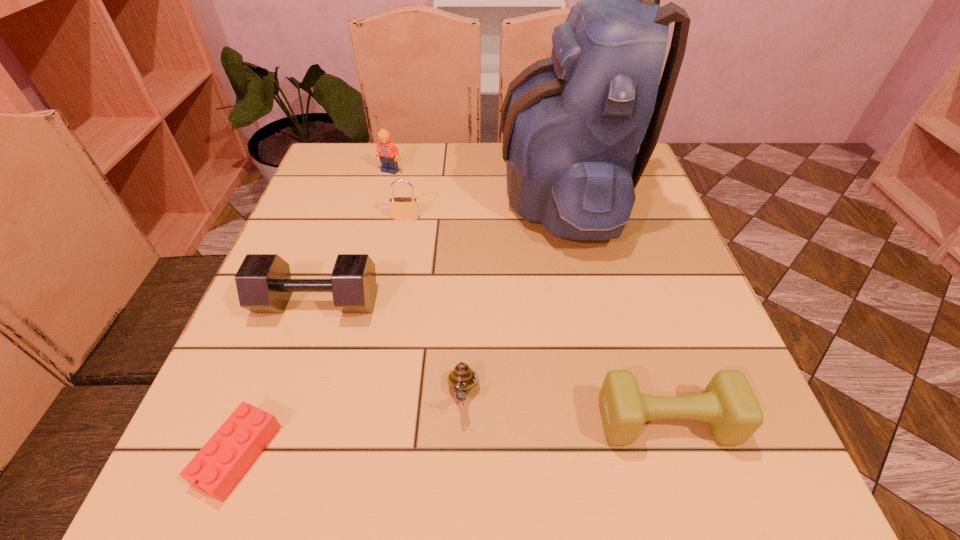
Where is `object present at the near right corner`? This screenshot has width=960, height=540. object present at the near right corner is located at coordinates (728, 404).

The width and height of the screenshot is (960, 540). I want to click on free space at the far edge, so click(x=461, y=192).

In the image, there is a desktop. Where is `vacant area at the near edge`? This screenshot has width=960, height=540. vacant area at the near edge is located at coordinates (615, 471).

Where is `free point at the left edge`? free point at the left edge is located at coordinates [335, 234].

You are a GUI agent. You are given a task and a screenshot of the screen. Output one action in this format:
    pyautogui.click(x=<x>, y=<y>)
    Task: Click on the blank space at the right edge
    The width and height of the screenshot is (960, 540).
    Given the screenshot: What is the action you would take?
    pyautogui.click(x=672, y=258)

Identify the location of blank space at the far left corner. This screenshot has height=540, width=960. (368, 156).

Locate an element on the screen. This screenshot has width=960, height=540. vacant space at the near left corner is located at coordinates click(208, 502).

I want to click on vacant region between the nearer dumbbell and the left Lego, so pyautogui.click(x=452, y=438).

This screenshot has height=540, width=960. I want to click on free space that is in between the shorter dumbbell and the nearer Lego, so click(x=452, y=438).

At what (x,y) coordinates should I click in order to perform the action: click on free area in between the farther Lego and the nearer dumbbell. Please return your answer as a coordinate pair (x, y). This screenshot has width=960, height=540. Looking at the image, I should click on (528, 296).